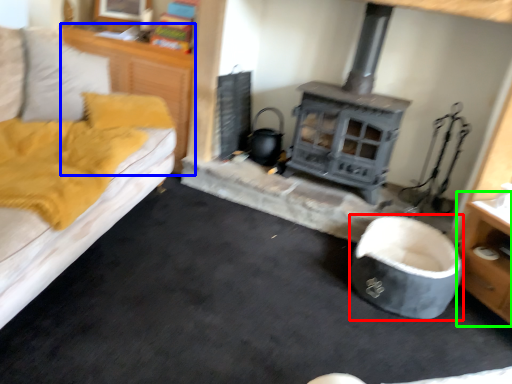
Question: Estimate the real-world distances between objects in this image. Which object is farther from bean bag chair (highlighted by a red box), dresser (highlighted by a blue box) or dresser (highlighted by a green box)?

Choices:
 (A) dresser
 (B) dresser

Answer: (A)